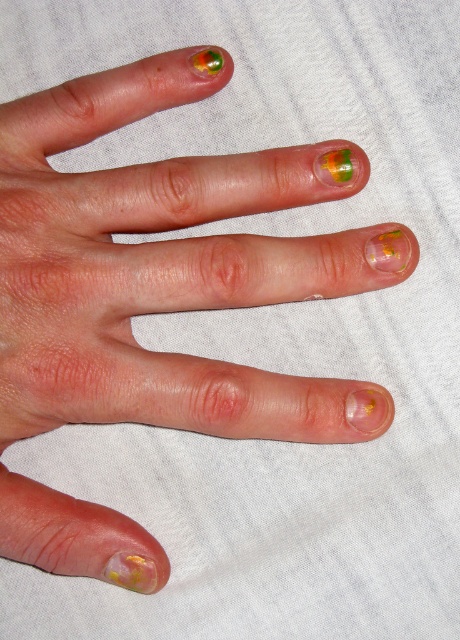
Question: From the image, what is the correct spatial relationship of shiny yellow-green nail polish at lower left in relation to green matte nail polish at upper center?

Choices:
 (A) above
 (B) below

Answer: (B)

Question: Which of the following is the closest to the observer?

Choices:
 (A) green matte nail polish at upper center
 (B) shiny yellow-green nail polish at lower left

Answer: (B)

Question: Does shiny yellow-green nail polish at lower left appear on the right side of green matte nail polish at upper center?

Choices:
 (A) yes
 (B) no

Answer: (B)

Question: Which point is farther to the camera?

Choices:
 (A) shiny yellow-green nail polish at lower left
 (B) green matte nail polish at upper center

Answer: (B)

Question: Which point is farther to the camera?

Choices:
 (A) green matte nail polish at upper center
 (B) shiny yellow-green nail polish at lower left

Answer: (A)

Question: Where is shiny yellow-green nail polish at lower left located in relation to green matte nail polish at upper center in the image?

Choices:
 (A) above
 (B) below

Answer: (B)